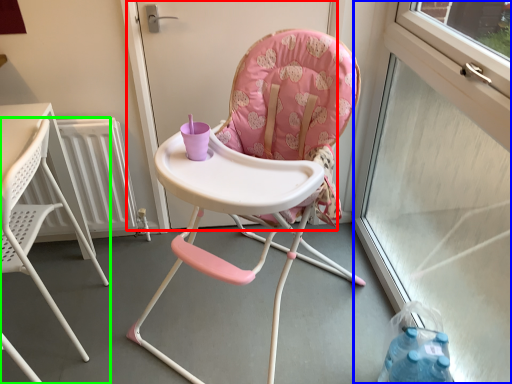
Question: Based on their relative distances, which object is farther from screen door (highlighted by a red box)? Choose from window screen (highlighted by a blue box) and chair (highlighted by a green box).

Choices:
 (A) window screen
 (B) chair

Answer: (A)